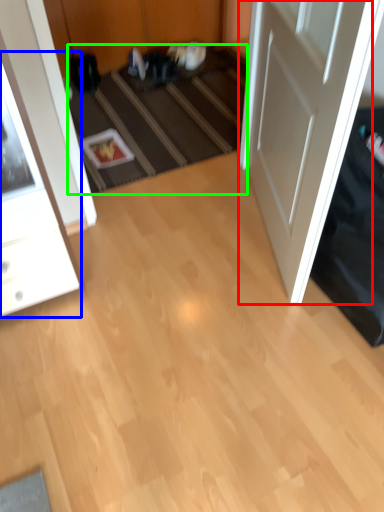
Question: Estimate the real-world distances between objects in this image. Which object is farther from door (highlighted by a red box), cabinetry (highlighted by a blue box) or stair (highlighted by a green box)?

Choices:
 (A) cabinetry
 (B) stair

Answer: (A)